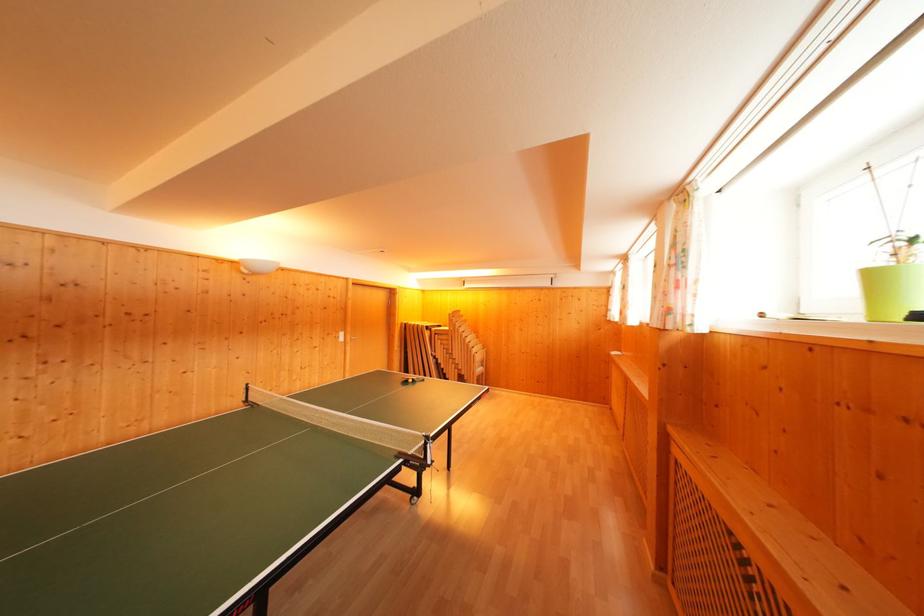
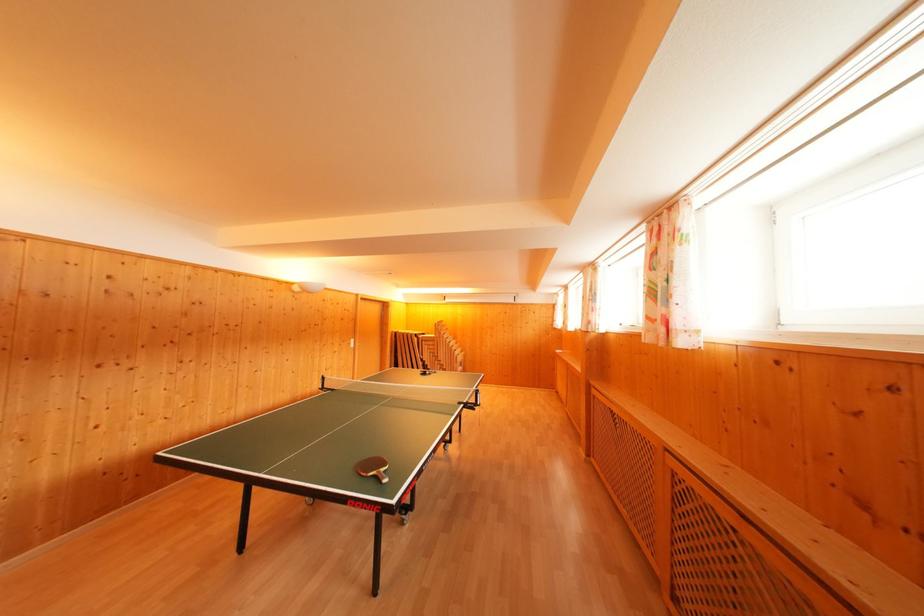
Find the pixel in the second image that matches (460,360) in the first image.

(445, 362)